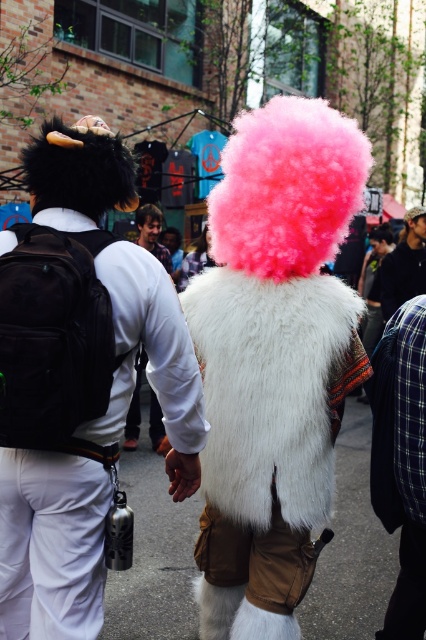
The image size is (426, 640). I want to click on black fuzzy wig at upper left, so click(x=80, y=170).

Consider the image. Does black fuzzy wig at upper left have a smaller size compared to white fur coat at center?

Correct, black fuzzy wig at upper left occupies less space than white fur coat at center.

The height and width of the screenshot is (640, 426). What are the coordinates of `black fuzzy wig at upper left` in the screenshot? It's located at (80, 170).

Does fuzzy white fur coat at center lie in front of plaid fabric shirt at right?

Yes, fuzzy white fur coat at center is in front of plaid fabric shirt at right.

Between point (103, 573) and point (408, 433), which one is positioned behind?

Point (408, 433)

Does point (83, 588) lie in front of point (393, 368)?

Yes, it is.

Where is `fuzzy white fur coat at center`? fuzzy white fur coat at center is located at coordinates (78, 384).

Does fuzzy white fur coat at center have a larger size compared to pink fluffy wig at upper center?

Yes, fuzzy white fur coat at center is bigger than pink fluffy wig at upper center.

Does fuzzy white fur coat at center have a greater width compared to pink fluffy wig at upper center?

Correct, the width of fuzzy white fur coat at center exceeds that of pink fluffy wig at upper center.

Where is `fuzzy white fur coat at center`? The image size is (426, 640). fuzzy white fur coat at center is located at coordinates click(x=78, y=384).